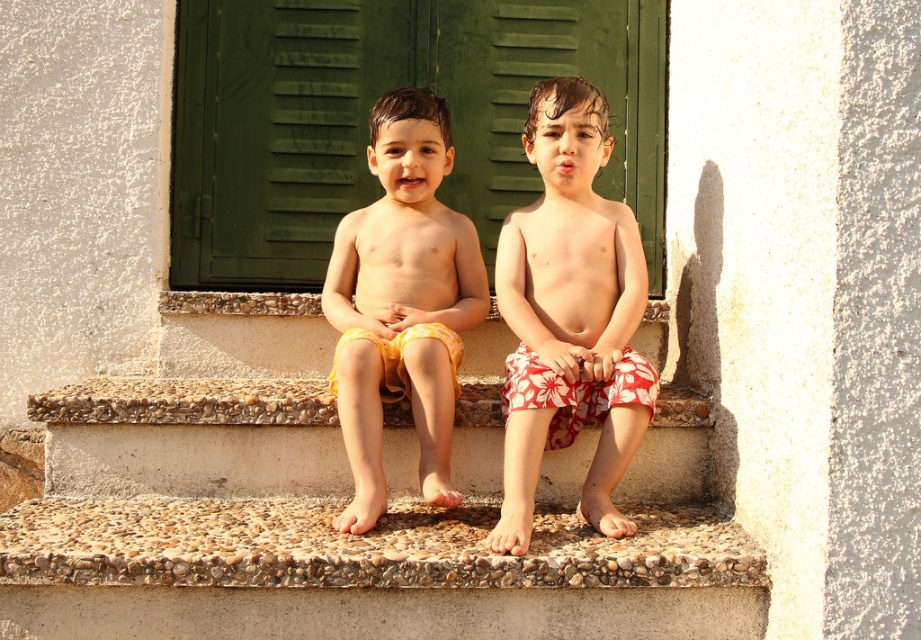
Which is above, green matte shutter at center or yellow cotton shorts at center?

green matte shutter at center is above.

I want to click on green matte shutter at center, so click(367, 113).

Where is `green matte shutter at center`? The height and width of the screenshot is (640, 921). green matte shutter at center is located at coordinates (367, 113).

Does point (70, 493) lie behind point (556, 92)?

No, it is in front of (556, 92).

Who is shorter, smooth stone stairs at center or red floral shorts at center?

With less height is smooth stone stairs at center.

You are a GUI agent. You are given a task and a screenshot of the screen. Output one action in this format:
    pyautogui.click(x=<x>, y=<y>)
    Task: Click on the smooth stone stairs at center
    This screenshot has height=640, width=921.
    Given the screenshot: What is the action you would take?
    pyautogui.click(x=340, y=508)

Who is shorter, smooth stone stairs at center or green matte shutter at center?

With less height is smooth stone stairs at center.

Where is `smooth stone stairs at center`? This screenshot has width=921, height=640. smooth stone stairs at center is located at coordinates (340, 508).